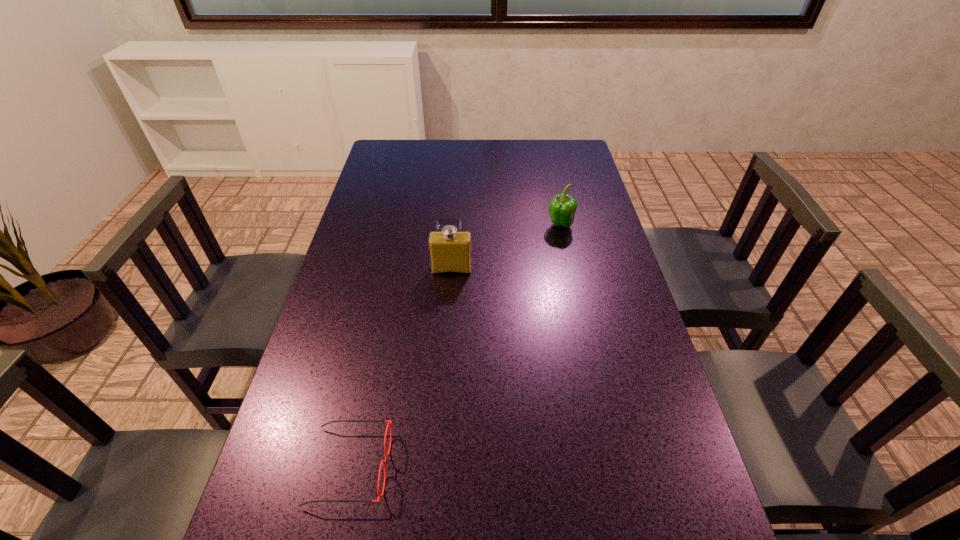
At what (x,y) coordinates should I click in order to perform the action: click on the second nearest object. Please return your answer as a coordinate pair (x, y). This screenshot has height=540, width=960. Looking at the image, I should click on (450, 252).

Where is `the second object from right to left`? Image resolution: width=960 pixels, height=540 pixels. the second object from right to left is located at coordinates (450, 252).

Image resolution: width=960 pixels, height=540 pixels. I want to click on bell pepper, so click(x=562, y=208).

This screenshot has height=540, width=960. In order to click on the farthest object in this screenshot , I will do `click(562, 208)`.

Find the location of `the shortest object`. the shortest object is located at coordinates click(389, 421).

Where is `the leftmost object`? This screenshot has width=960, height=540. the leftmost object is located at coordinates (389, 421).

Where is `free space located 0.330m on the front-facing side of the second nearest object`? This screenshot has width=960, height=540. free space located 0.330m on the front-facing side of the second nearest object is located at coordinates (444, 370).

The width and height of the screenshot is (960, 540). I want to click on free location located 0.080m on the left of the rightmost object, so click(522, 225).

What are the coordinates of `free space located on the front-facing side of the leftmost object` in the screenshot? It's located at (482, 466).

At what (x,y) coordinates should I click in order to perform the action: click on object situated at the left edge. Please return your answer as a coordinate pair (x, y). The height and width of the screenshot is (540, 960). Looking at the image, I should click on (389, 421).